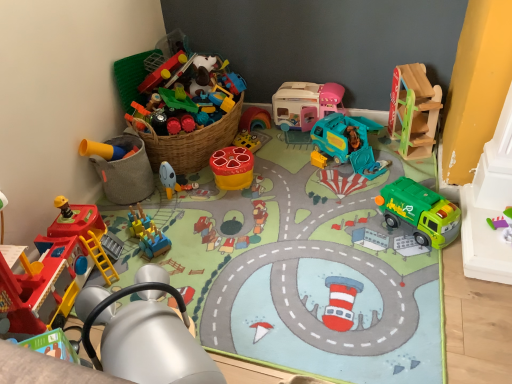
Where is `vacant space positioned to the left of matte plastic toy at center, the 7th toy viewed from the right`? vacant space positioned to the left of matte plastic toy at center, the 7th toy viewed from the right is located at coordinates (147, 199).